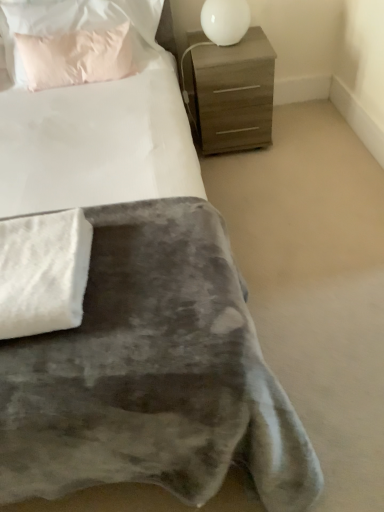
Image resolution: width=384 pixels, height=512 pixels. In order to click on free point above white fluffy blanket at lower left (from a real-world perspective) in this screenshot , I will do `click(45, 258)`.